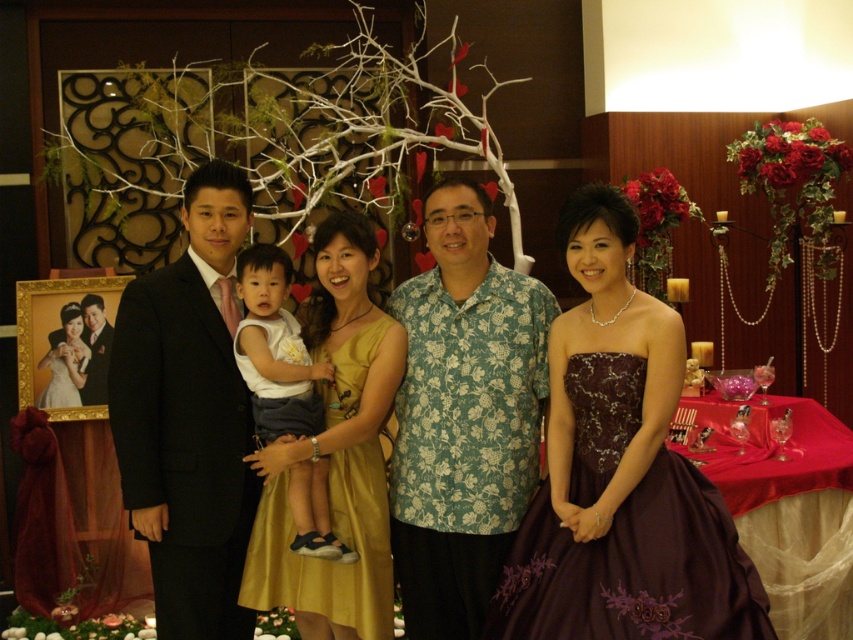
You are standing in front of the group photo and notice a point marked at coordinates (463, 416). Based on the scene description, what object or person does this point most likely correspond to?

The point at coordinates (463, 416) corresponds to the green floral shirt at center.